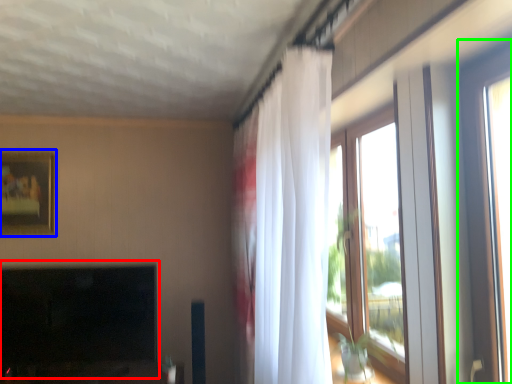
Question: Which object is the farthest from fireplace (highlighted by a red box)? Choose among these: picture frame (highlighted by a blue box) or window (highlighted by a green box).

Choices:
 (A) picture frame
 (B) window

Answer: (B)